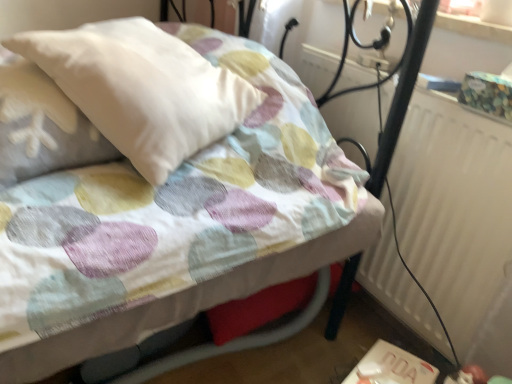
The height and width of the screenshot is (384, 512). Identify the location of vacant space situated above white textured radiator at right (from a real-world perspective). (418, 73).